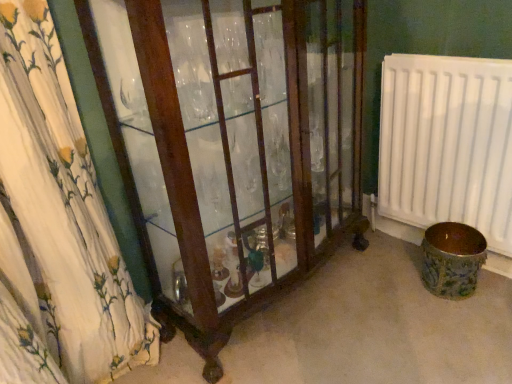
Question: In terms of height, does mahogany glass cabinet at left look taller or shorter compared to white plastic radiator at right?

Choices:
 (A) tall
 (B) short

Answer: (A)

Question: Is mahogany glass cabinet at left in front of or behind white plastic radiator at right in the image?

Choices:
 (A) front
 (B) behind

Answer: (A)

Question: Considering the real-world distances, which object is closest to the white plastic radiator at right?

Choices:
 (A) brown ceramic vase at lower right
 (B) mahogany glass cabinet at left

Answer: (A)

Question: Which is nearer to the white plastic radiator at right?

Choices:
 (A) brown ceramic vase at lower right
 (B) mahogany glass cabinet at left

Answer: (A)